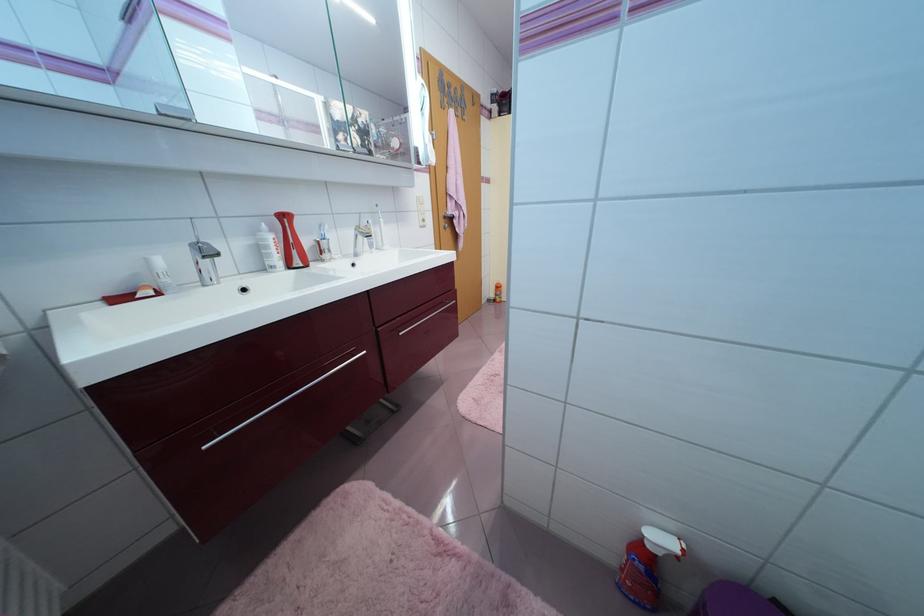
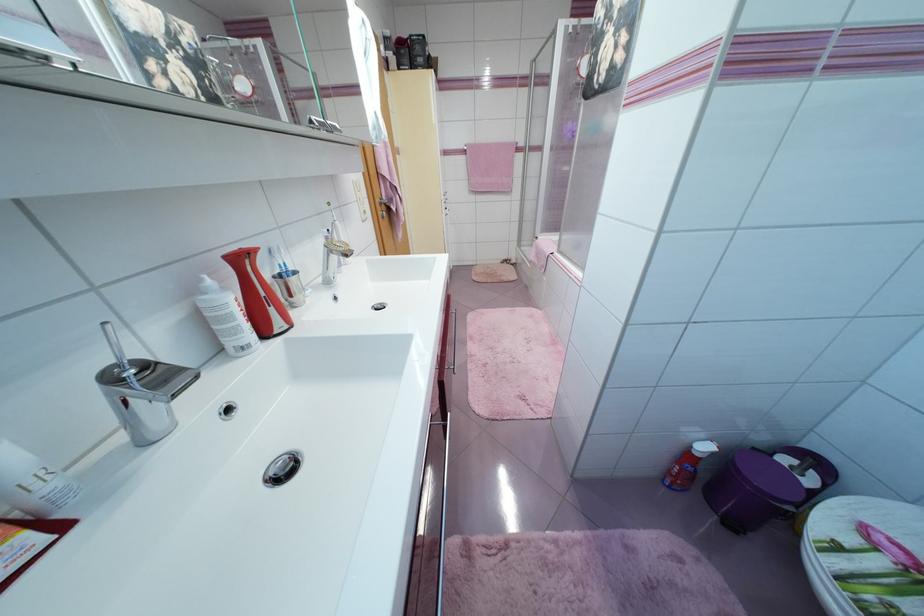
Question: Based on the continuous images, in which direction is the camera rotating? Reply with the corresponding letter.

Choices:
 (A) Left
 (B) Right
 (C) Up
 (D) Down

Answer: (B)